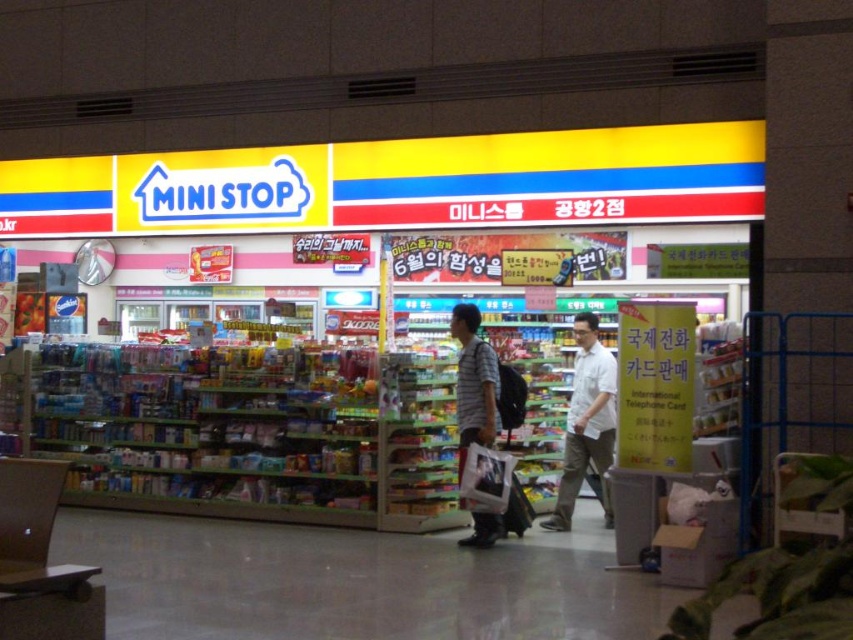
Question: Can you confirm if yellow matte sign at upper center is wider than striped cotton shirt at center?

Choices:
 (A) no
 (B) yes

Answer: (B)

Question: Which is farther from the striped cotton shirt at center?

Choices:
 (A) yellow matte sign at upper center
 (B) white cotton shirt at center

Answer: (A)

Question: Which point is closer to the camera?

Choices:
 (A) (479, 532)
 (B) (96, 227)

Answer: (A)

Question: Which object is positioned closest to the yellow matte sign at upper center?

Choices:
 (A) striped cotton shirt at center
 (B) white cotton shirt at center

Answer: (A)

Question: Can you confirm if yellow matte sign at upper center is positioned above striped cotton shirt at center?

Choices:
 (A) yes
 (B) no

Answer: (A)

Question: Does yellow matte sign at upper center appear over white cotton shirt at center?

Choices:
 (A) no
 (B) yes

Answer: (B)